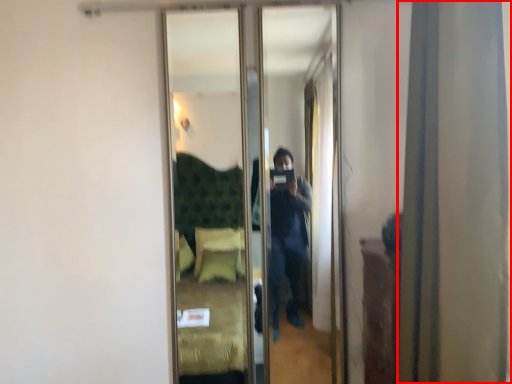
Question: From the image, what is the correct spatial relationship of curtain (annotated by the red box) in relation to mirror?

Choices:
 (A) right
 (B) left

Answer: (A)